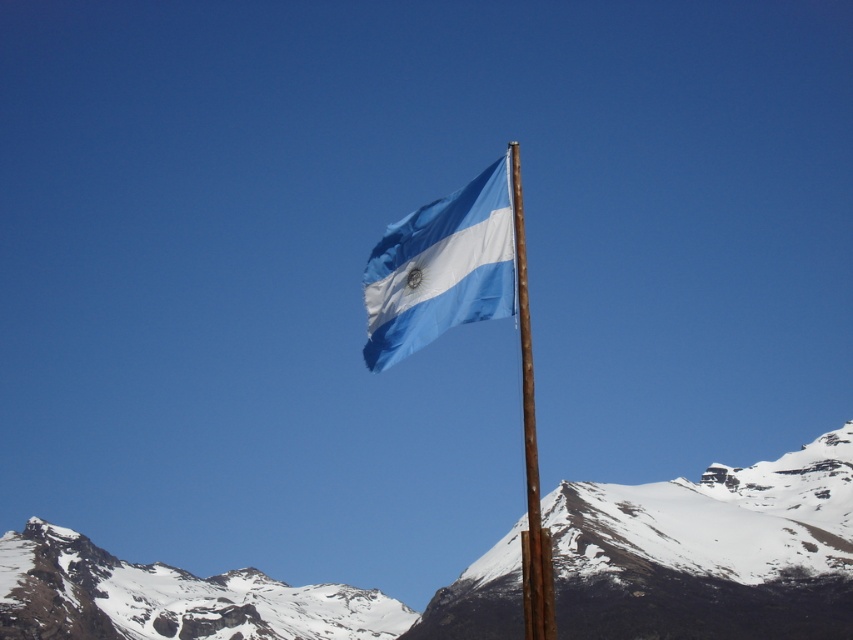
Does point (93, 572) come farther from viewer compared to point (448, 212)?

Yes, it is.

Who is positioned more to the right, snowy rock at center or blue fabric flag at center?

blue fabric flag at center

Where is `snowy rock at center`? snowy rock at center is located at coordinates (711, 550).

Is point (403, 346) closer to viewer compared to point (526, 340)?

Yes, point (403, 346) is closer to viewer.

This screenshot has height=640, width=853. Identify the location of blue fabric flag at center. (440, 268).

Can you confirm if snowy rock at center is positioned below rusty wood flag pole at center?

Indeed, snowy rock at center is positioned under rusty wood flag pole at center.

Between snowy rock at center and rusty wood flag pole at center, which one has less height?

With less height is snowy rock at center.

This screenshot has width=853, height=640. What do you see at coordinates (711, 550) in the screenshot?
I see `snowy rock at center` at bounding box center [711, 550].

Image resolution: width=853 pixels, height=640 pixels. Identify the location of snowy rock at center. (711, 550).